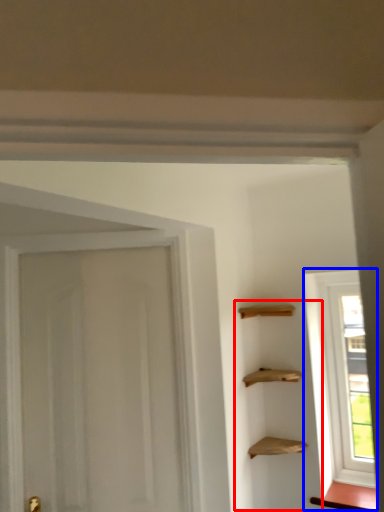
Question: Which object appears farthest to the camera in this image, cabinetry (highlighted by a red box) or window (highlighted by a blue box)?

Choices:
 (A) cabinetry
 (B) window

Answer: (B)